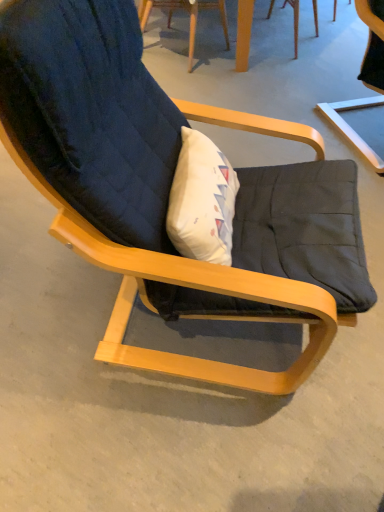
Question: Can you confirm if dark blue fabric chair at upper center, the second chair when ordered from right to left, is bigger than wooden table at upper center?

Choices:
 (A) yes
 (B) no

Answer: (A)

Question: Can you confirm if dark blue fabric chair at upper center, the second chair when ordered from right to left, is taller than wooden table at upper center?

Choices:
 (A) no
 (B) yes

Answer: (B)

Question: Would you consider dark blue fabric chair at upper center, the second chair when ordered from right to left, to be distant from wooden table at upper center?

Choices:
 (A) yes
 (B) no

Answer: (B)

Question: Is dark blue fabric chair at upper center, placed as the first chair when sorted from left to right, thinner than wooden table at upper center?

Choices:
 (A) no
 (B) yes

Answer: (A)

Question: From a real-world perspective, is dark blue fabric chair at upper center, the second chair when ordered from right to left, over wooden table at upper center?

Choices:
 (A) no
 (B) yes

Answer: (B)

Question: From a real-world perspective, relative to dark blue fabric chair at upper center, placed as the first chair when sorted from left to right, is wooden table at upper center vertically above or below?

Choices:
 (A) below
 (B) above

Answer: (A)

Question: Is wooden table at upper center taller or shorter than dark blue fabric chair at upper center, the second chair when ordered from right to left?

Choices:
 (A) short
 (B) tall

Answer: (A)

Question: Is point (314, 4) closer or farther from the camera than point (177, 2)?

Choices:
 (A) closer
 (B) farther

Answer: (B)

Question: Is wooden table at upper center to the left or to the right of dark blue fabric chair at upper center, the second chair when ordered from right to left, in the image?

Choices:
 (A) left
 (B) right

Answer: (B)

Question: Looking at the image, does dark blue fabric chair at upper center, placed as the first chair when sorted from left to right, seem bigger or smaller compared to matte black cushion at center, which is counted as the 1th chair, starting from the right?

Choices:
 (A) big
 (B) small

Answer: (B)

Question: Is dark blue fabric chair at upper center, placed as the first chair when sorted from left to right, inside or outside of matte black cushion at center, which is counted as the 1th chair, starting from the right?

Choices:
 (A) inside
 (B) outside

Answer: (B)

Question: Considering the positions of dark blue fabric chair at upper center, placed as the first chair when sorted from left to right, and matte black cushion at center, which is counted as the 1th chair, starting from the right, in the image, is dark blue fabric chair at upper center, placed as the first chair when sorted from left to right, taller or shorter than matte black cushion at center, which is counted as the 1th chair, starting from the right,?

Choices:
 (A) short
 (B) tall

Answer: (A)

Question: From a real-world perspective, relative to matte black cushion at center, which is counted as the 1th chair, starting from the right, is dark blue fabric chair at upper center, the second chair when ordered from right to left, vertically above or below?

Choices:
 (A) above
 (B) below

Answer: (B)

Question: From the image's perspective, is matte black cushion at center, which ranks as the second chair in left-to-right order, above or below wooden table at upper center?

Choices:
 (A) above
 (B) below

Answer: (B)

Question: Based on their sizes in the image, would you say matte black cushion at center, which ranks as the second chair in left-to-right order, is bigger or smaller than wooden table at upper center?

Choices:
 (A) small
 (B) big

Answer: (B)